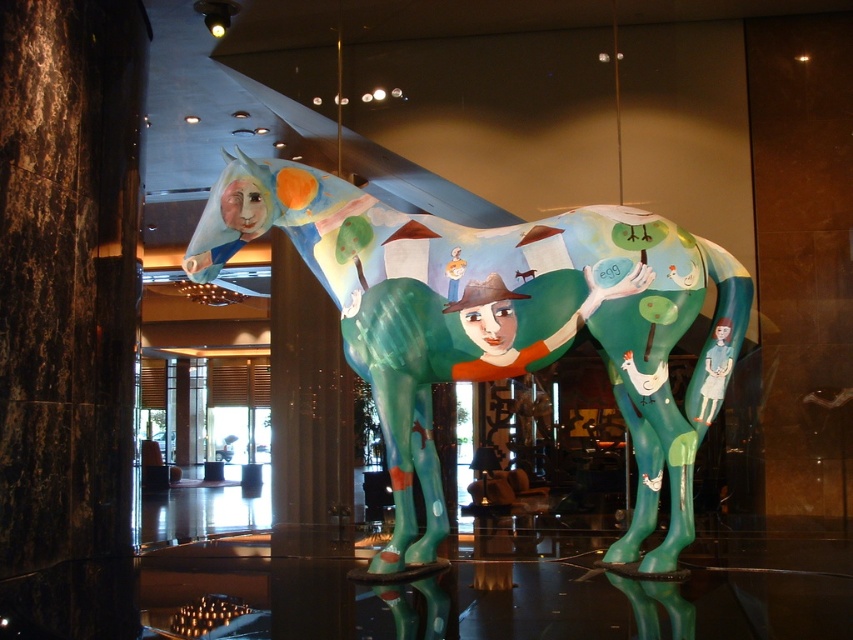
Question: Is shiny painted horse at center positioned before black polished stone pillar at center?

Choices:
 (A) yes
 (B) no

Answer: (A)

Question: Is shiny painted horse at center thinner than black polished stone pillar at center?

Choices:
 (A) yes
 (B) no

Answer: (B)

Question: Which of the following is the farthest from the observer?

Choices:
 (A) shiny painted horse at center
 (B) black polished stone pillar at center

Answer: (B)

Question: Which point is farther to the camera?

Choices:
 (A) (662, 362)
 (B) (289, 541)

Answer: (B)

Question: Is shiny painted horse at center to the right of black polished stone pillar at center from the viewer's perspective?

Choices:
 (A) yes
 (B) no

Answer: (A)